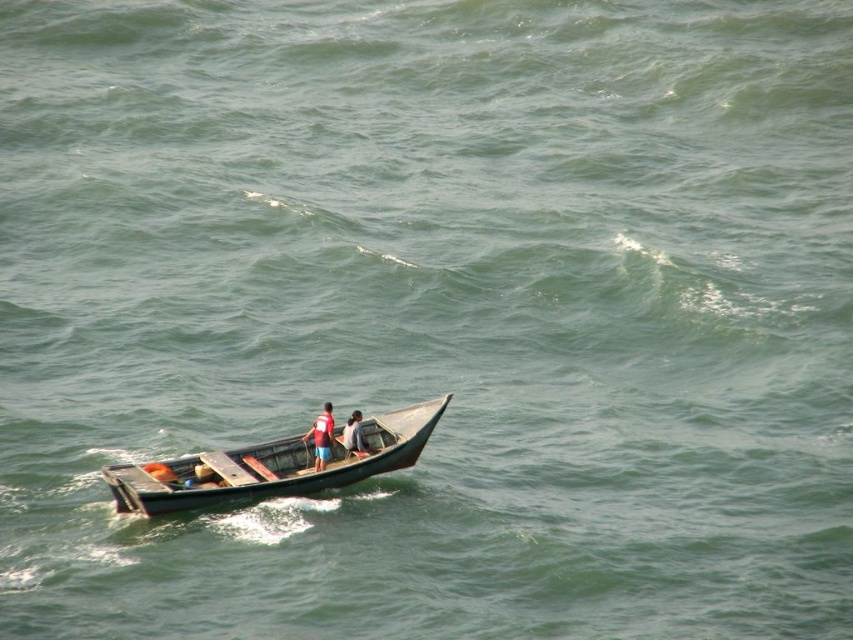
You are a passenger on the wooden boat at center and need to grab the matte red life vest at center quickly. Which direction should you move to reach it?

The wooden boat at center is positioned under the matte red life vest at center, so you should move upward to reach it.

You are standing on the deck of the boat and want to take a photo of the point marked at coordinates point (328, 460). If your camera has a maximum zoom range of 100 feet, will you be able to capture the point in the photo?

The point marked at coordinates point (328, 460) is 113.34 feet away from the camera. Since the camera can only zoom up to 100 feet, you will not be able to capture the point in the photo.

You are a safety inspector checking the boat for proper equipment. You notice the matte red life vest at center and the red fabric shirt at center. Which item is bigger in size?

The matte red life vest at center has a larger size compared to the red fabric shirt at center.